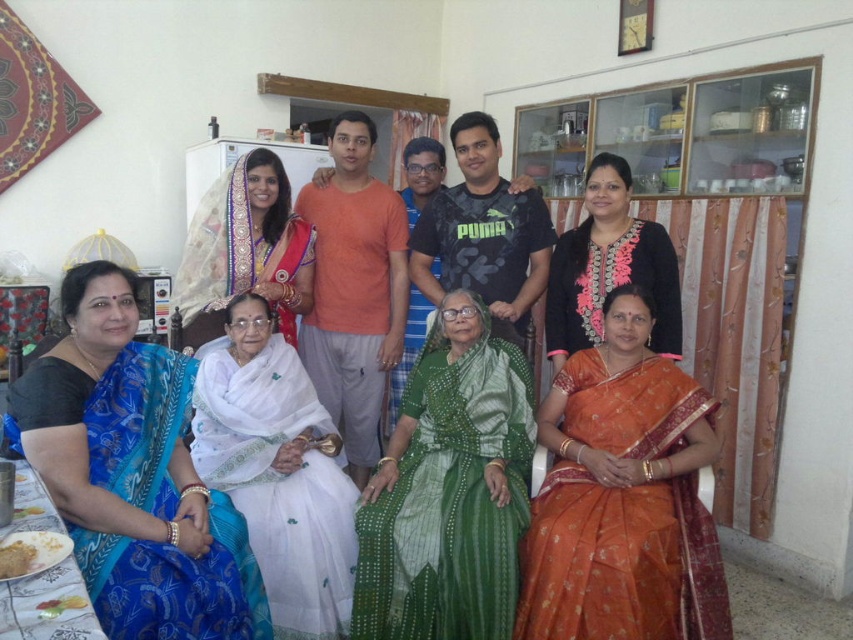
Question: Does white silk saree at center appear over golden textured rice at lower left?

Choices:
 (A) no
 (B) yes

Answer: (A)

Question: Can you confirm if white silk saree at center is smaller than white silk saree at upper left?

Choices:
 (A) no
 (B) yes

Answer: (A)

Question: Which object is positioned farthest from the silky blue sari at lower left?

Choices:
 (A) white silk saree at upper left
 (B) golden textured rice at lower left
 (C) black silk saree at upper center
 (D) green silk saree at center

Answer: (B)

Question: Estimate the real-world distances between objects in this image. Which object is closer to the white silk saree at upper left?

Choices:
 (A) green silk saree at center
 (B) white silk saree at center

Answer: (B)

Question: Does silky blue sari at lower left have a larger size compared to orange silk saree at lower right?

Choices:
 (A) no
 (B) yes

Answer: (B)

Question: Among these points, which one is nearest to the camera?

Choices:
 (A) (328, 454)
 (B) (589, 458)

Answer: (B)